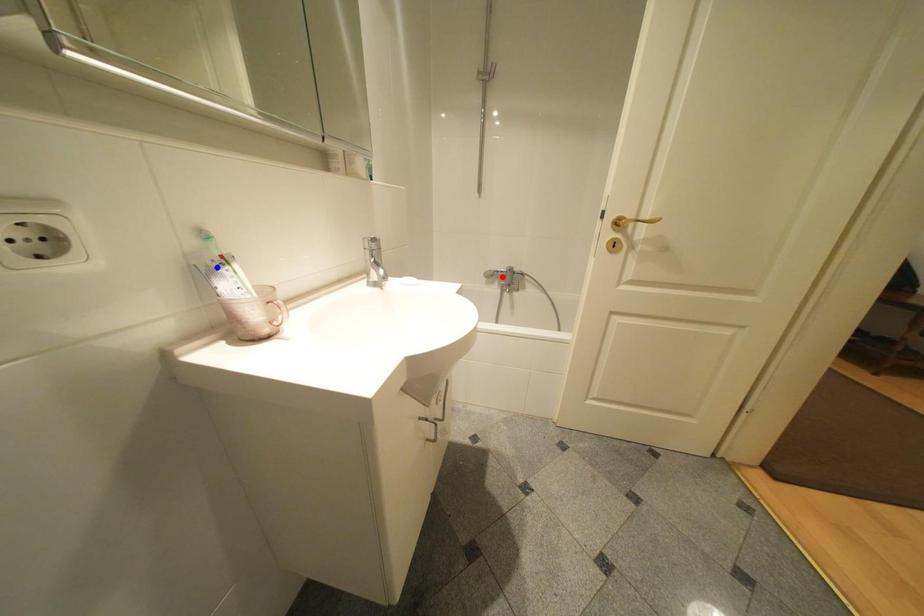
Question: Two points are marked on the image. Which point is closer to the camera?

Choices:
 (A) Blue point is closer.
 (B) Red point is closer.

Answer: (A)